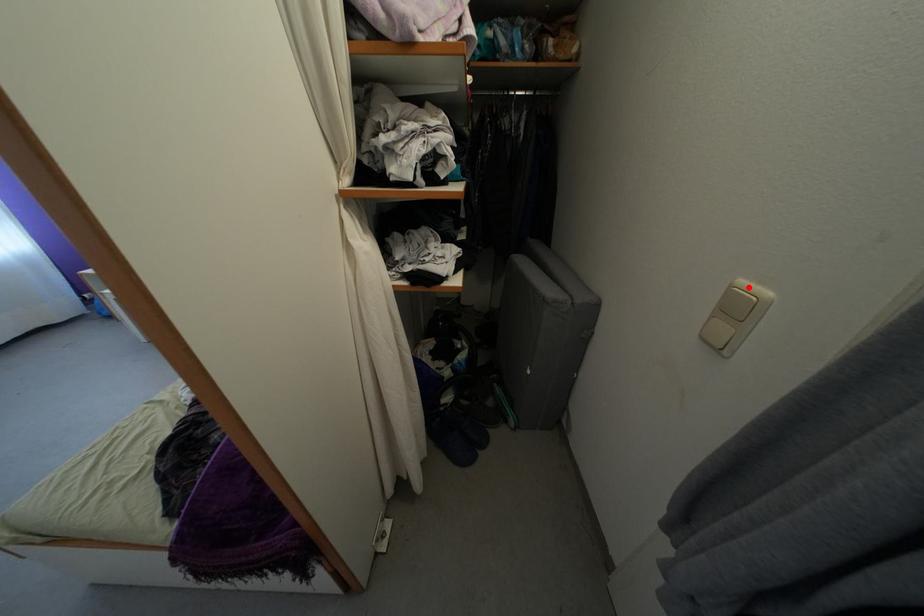
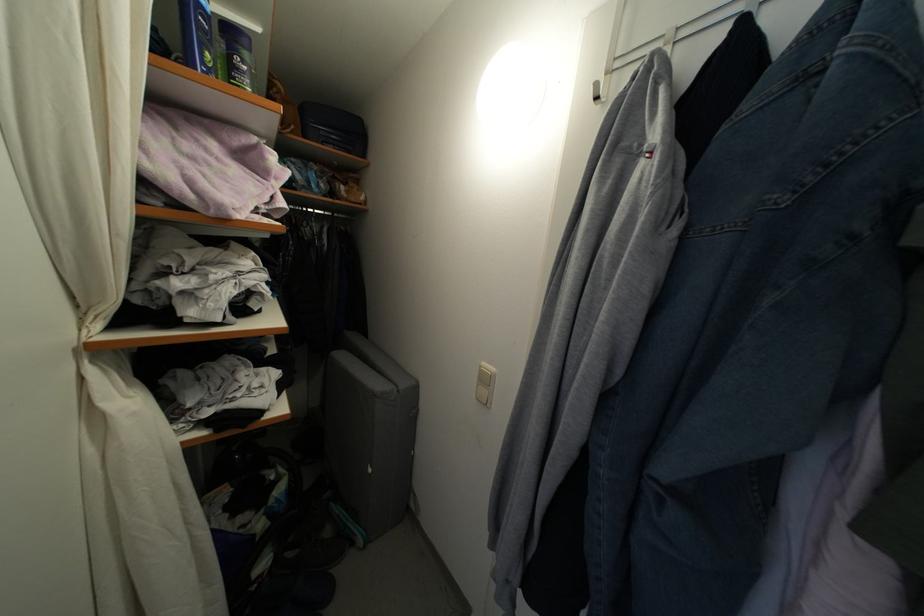
Locate, in the second image, the point that corresponds to the highlighted location in the first image.

(489, 370)